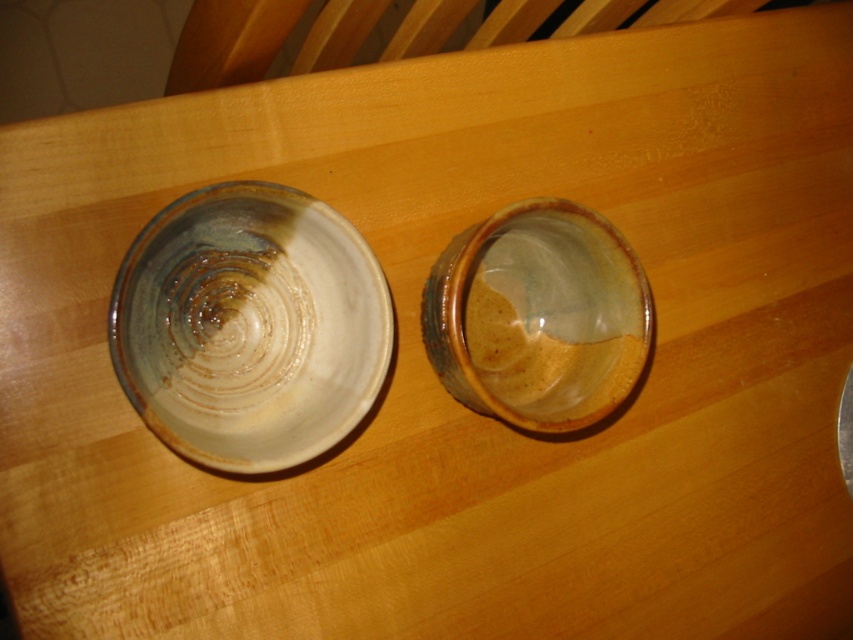
You are arranging decorative items on a shelf and need to place a small vase between the two matte ceramic bowls. Since the shelf space is limited, can you fit the vase between the matte ceramic bowl at left and the matte ceramic bowl at center?

The matte ceramic bowl at left is to the left of the matte ceramic bowl at center, so there is space between them. If the vase is smaller than the distance between the two bowls, it should fit.

You are arranging bowls on a shelf and need to know their positions. Which bowl is placed lower on the shelf, the matte ceramic bowl at left or the matte ceramic bowl at center?

The matte ceramic bowl at left is located below the matte ceramic bowl at center, so it is placed lower on the shelf.